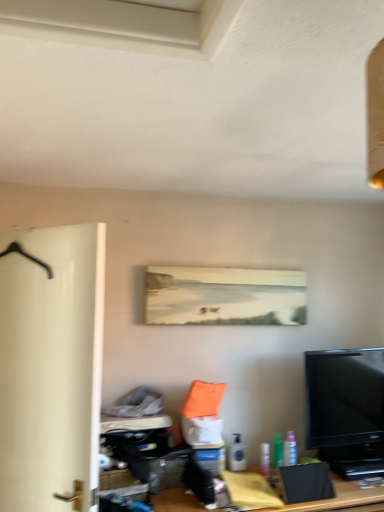
I want to click on wooden desk at center, so click(337, 498).

What do you see at coordinates (277, 451) in the screenshot? I see `green plastic bottle at lower right, acting as the second toiletry starting from the left` at bounding box center [277, 451].

The width and height of the screenshot is (384, 512). What do you see at coordinates (237, 454) in the screenshot?
I see `translucent plastic spray can at lower center, the third toiletry when ordered from right to left` at bounding box center [237, 454].

At what (x,y) coordinates should I click in order to perform the action: click on translucent plastic spray can at lower center, the third toiletry when ordered from right to left. Please return your answer as a coordinate pair (x, y). The width and height of the screenshot is (384, 512). Looking at the image, I should click on (237, 454).

Find the location of a particular element. This screenshot has height=512, width=384. wooden desk at center is located at coordinates (337, 498).

From a real-world perspective, who is located lower, white matte door at left or matte canvas painting at center?

In real-world perspective, white matte door at left is lower.

Is matte canvas painting at center located within white matte door at left?

Actually, matte canvas painting at center is outside white matte door at left.

Considering the sizes of white matte door at left and matte canvas painting at center in the image, is white matte door at left bigger or smaller than matte canvas painting at center?

white matte door at left is bigger than matte canvas painting at center.

Which object is closer to the camera taking this photo, white matte door at left or matte canvas painting at center?

Positioned in front is white matte door at left.

Can you confirm if green plastic bottle at lower right, the second toiletry positioned from the right, is smaller than wooden desk at center?

Correct, green plastic bottle at lower right, the second toiletry positioned from the right, occupies less space than wooden desk at center.

Is green plastic bottle at lower right, the second toiletry positioned from the right, looking in the opposite direction of wooden desk at center?

green plastic bottle at lower right, the second toiletry positioned from the right, does not have its back to wooden desk at center.

How different are the orientations of green plastic bottle at lower right, the second toiletry positioned from the right, and wooden desk at center in degrees?

There is a 7.32-degree angle between the facing directions of green plastic bottle at lower right, the second toiletry positioned from the right, and wooden desk at center.

Are green plastic bottle at lower right, the second toiletry positioned from the right, and wooden desk at center beside each other?

No.

Is wooden desk at center taller or shorter than green plastic bottle at lower right, the second toiletry positioned from the right?

wooden desk at center is taller than green plastic bottle at lower right, the second toiletry positioned from the right.

How many degrees apart are the facing directions of wooden desk at center and green plastic bottle at lower right, the second toiletry positioned from the right?

7.32 degrees separate the facing orientations of wooden desk at center and green plastic bottle at lower right, the second toiletry positioned from the right.

Considering the relative sizes of wooden desk at center and green plastic bottle at lower right, the second toiletry positioned from the right, in the image provided, is wooden desk at center smaller than green plastic bottle at lower right, the second toiletry positioned from the right,?

Incorrect, wooden desk at center is not smaller in size than green plastic bottle at lower right, the second toiletry positioned from the right.

Which object is more forward, wooden desk at center or green plastic bottle at lower right, acting as the second toiletry starting from the left?

wooden desk at center.

Which of these two, pink plastic spray bottle at lower right, acting as the 3th toiletry starting from the left, or green plastic bottle at lower right, the second toiletry positioned from the right, stands taller?

Standing taller between the two is pink plastic spray bottle at lower right, acting as the 3th toiletry starting from the left.

Is pink plastic spray bottle at lower right, positioned as the first toiletry in right-to-left order, directly adjacent to green plastic bottle at lower right, acting as the second toiletry starting from the left?

Yes.

Is pink plastic spray bottle at lower right, positioned as the first toiletry in right-to-left order, in front of or behind green plastic bottle at lower right, the second toiletry positioned from the right, in the image?

In the image, pink plastic spray bottle at lower right, positioned as the first toiletry in right-to-left order, appears behind green plastic bottle at lower right, the second toiletry positioned from the right.

How different are the orientations of pink plastic spray bottle at lower right, acting as the 3th toiletry starting from the left, and green plastic bottle at lower right, the second toiletry positioned from the right, in degrees?

0.011 degrees.

From a real-world perspective, which is physically above, green plastic bottle at lower right, the second toiletry positioned from the right, or white matte door at left?

white matte door at left is physically above.

Which object is further away from the camera taking this photo, green plastic bottle at lower right, acting as the second toiletry starting from the left, or white matte door at left?

green plastic bottle at lower right, acting as the second toiletry starting from the left, is behind.

Between green plastic bottle at lower right, the second toiletry positioned from the right, and white matte door at left, which one has larger width?

Wider between the two is white matte door at left.

Between translucent plastic spray can at lower center, which appears as the first toiletry when viewed from the left, and black glossy tv at lower right, which one is positioned behind?

translucent plastic spray can at lower center, which appears as the first toiletry when viewed from the left, is further from the camera.

Are translucent plastic spray can at lower center, the third toiletry when ordered from right to left, and black glossy tv at lower right far apart?

No.

Does translucent plastic spray can at lower center, the third toiletry when ordered from right to left, have a greater width compared to black glossy tv at lower right?

No.

Is point (222, 307) positioned behind point (20, 270)?

Yes, point (222, 307) is behind point (20, 270).

Is matte canvas painting at center positioned with its back to white matte door at left?

matte canvas painting at center does not have its back to white matte door at left.

Is matte canvas painting at center directly adjacent to white matte door at left?

No, matte canvas painting at center is not next to white matte door at left.

In the image, is matte canvas painting at center positioned in front of or behind white matte door at left?

Result: In the image, matte canvas painting at center appears behind white matte door at left.

In order to click on picture frame above the white matte door at left (from the image's perspective) in this screenshot , I will do `click(224, 296)`.

The image size is (384, 512). Identify the location of the 1st toiletry to the left of the wooden desk at center, counting from the anchor's position. (277, 451).

When comparing their distances from white matte door at left, does pink plastic spray bottle at lower right, positioned as the first toiletry in right-to-left order, or black glossy tv at lower right seem closer?

The object closer to white matte door at left is pink plastic spray bottle at lower right, positioned as the first toiletry in right-to-left order.

Looking at the image, which one is located closer to wooden desk at center, green plastic bottle at lower right, acting as the second toiletry starting from the left, or translucent plastic spray can at lower center, the third toiletry when ordered from right to left?

green plastic bottle at lower right, acting as the second toiletry starting from the left, lies closer to wooden desk at center than the other object.

From the image, which object appears to be farther from green plastic bottle at lower right, the second toiletry positioned from the right, translucent plastic spray can at lower center, the third toiletry when ordered from right to left, or white matte door at left?

The object further to green plastic bottle at lower right, the second toiletry positioned from the right, is white matte door at left.

Which object lies further to the anchor point pink plastic spray bottle at lower right, positioned as the first toiletry in right-to-left order, white matte door at left or black glossy tv at lower right?

white matte door at left.

In the scene shown: Based on their spatial positions, is translucent plastic spray can at lower center, the third toiletry when ordered from right to left, or pink plastic spray bottle at lower right, acting as the 3th toiletry starting from the left, further from black glossy tv at lower right?

Among the two, translucent plastic spray can at lower center, the third toiletry when ordered from right to left, is located further to black glossy tv at lower right.

Estimate the real-world distances between objects in this image. Which object is further from black glossy tv at lower right, white matte door at left or matte canvas painting at center?

white matte door at left.

Considering their positions, is white matte door at left positioned closer to matte canvas painting at center than wooden desk at center?

white matte door at left lies closer to matte canvas painting at center than the other object.

Looking at the image, which one is located further to green plastic bottle at lower right, the second toiletry positioned from the right, pink plastic spray bottle at lower right, positioned as the first toiletry in right-to-left order, or black glossy tv at lower right?

Among the two, black glossy tv at lower right is located further to green plastic bottle at lower right, the second toiletry positioned from the right.

Find the location of a particular element. Image resolution: width=384 pixels, height=512 pixels. toiletry between matte canvas painting at center and translucent plastic spray can at lower center, which appears as the first toiletry when viewed from the left, from top to bottom is located at coordinates (290, 449).

Find the location of a particular element. This screenshot has width=384, height=512. toiletry situated between translucent plastic spray can at lower center, which appears as the first toiletry when viewed from the left, and pink plastic spray bottle at lower right, acting as the 3th toiletry starting from the left, from left to right is located at coordinates (277, 451).

Where is `television between wooden desk at center and green plastic bottle at lower right, the second toiletry positioned from the right, along the z-axis`? television between wooden desk at center and green plastic bottle at lower right, the second toiletry positioned from the right, along the z-axis is located at coordinates (346, 410).

The width and height of the screenshot is (384, 512). What are the coordinates of `picture frame between white matte door at left and pink plastic spray bottle at lower right, positioned as the first toiletry in right-to-left order, from left to right` in the screenshot? It's located at click(224, 296).